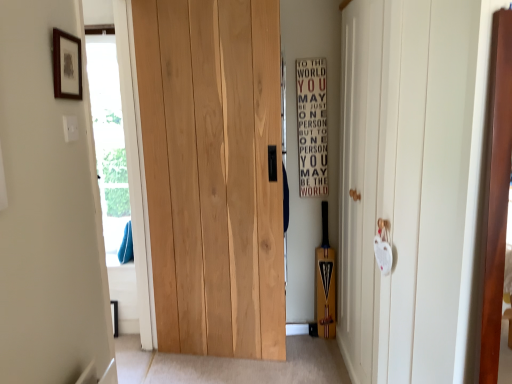
Question: Does white matte door at right, the second door in the left-to-right sequence, appear on the left side of wooden sign at center right?

Choices:
 (A) no
 (B) yes

Answer: (A)

Question: Can you confirm if white matte door at right, the second door in the left-to-right sequence, is shorter than wooden sign at center right?

Choices:
 (A) no
 (B) yes

Answer: (A)

Question: Considering the relative positions of white matte door at right, the second door in the left-to-right sequence, and wooden sign at center right in the image provided, is white matte door at right, the second door in the left-to-right sequence, in front of wooden sign at center right?

Choices:
 (A) yes
 (B) no

Answer: (A)

Question: Is white matte door at right, the first door when ordered from right to left, wider than wooden sign at center right?

Choices:
 (A) no
 (B) yes

Answer: (B)

Question: From the image's perspective, is white matte door at right, the first door when ordered from right to left, beneath wooden sign at center right?

Choices:
 (A) yes
 (B) no

Answer: (A)

Question: Is wooden sign at center right spatially inside transparent glass door at left, or outside of it?

Choices:
 (A) outside
 (B) inside

Answer: (A)

Question: Relative to transparent glass door at left, is wooden sign at center right in front or behind?

Choices:
 (A) behind
 (B) front

Answer: (A)

Question: From a real-world perspective, relative to transparent glass door at left, is wooden sign at center right vertically above or below?

Choices:
 (A) below
 (B) above

Answer: (B)

Question: Is wooden sign at center right bigger or smaller than transparent glass door at left?

Choices:
 (A) small
 (B) big

Answer: (A)

Question: Is natural wood door at center, the second door from the right, bigger or smaller than wooden sign at center right?

Choices:
 (A) big
 (B) small

Answer: (A)

Question: Looking at their shapes, would you say natural wood door at center, which is the first door in left-to-right order, is wider or thinner than wooden sign at center right?

Choices:
 (A) thin
 (B) wide

Answer: (B)

Question: Is natural wood door at center, which is the first door in left-to-right order, in front of or behind wooden sign at center right in the image?

Choices:
 (A) front
 (B) behind

Answer: (A)

Question: From a real-world perspective, relative to wooden sign at center right, is natural wood door at center, the second door from the right, vertically above or below?

Choices:
 (A) above
 (B) below

Answer: (B)

Question: In the image, is natural wood door at center, the second door from the right, positioned in front of or behind transparent glass door at left?

Choices:
 (A) front
 (B) behind

Answer: (B)

Question: Is natural wood door at center, the second door from the right, to the left or to the right of transparent glass door at left in the image?

Choices:
 (A) left
 (B) right

Answer: (B)